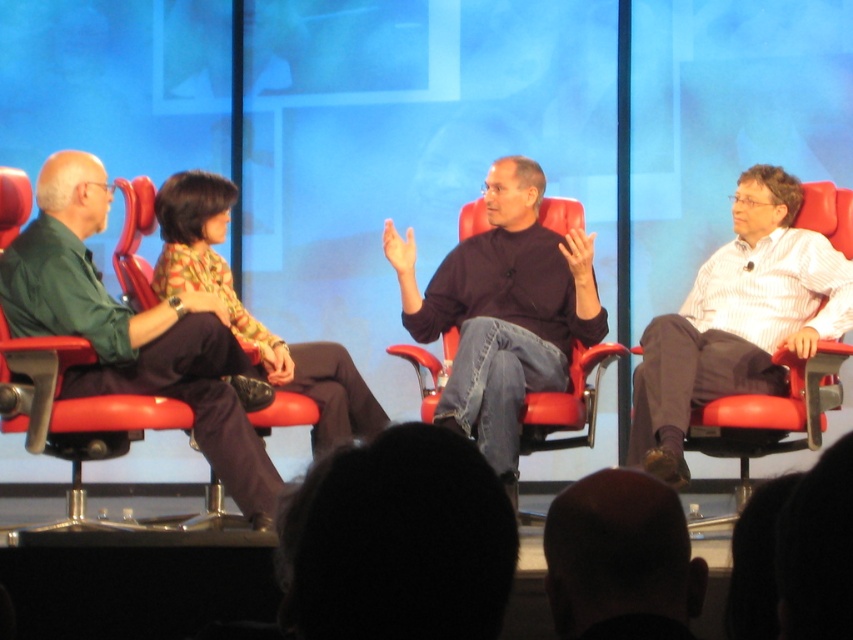
You are an event photographer at the panel discussion. You need to capture a clear photo of the speaker wearing the dark brown sweater at center without the printed fabric blouse at center appearing in the foreground. Is this possible based on their positions?

The dark brown sweater at center is positioned over the printed fabric blouse at center, so the blouse will be obscured by the sweater in the photo. Therefore, it is possible to capture a clear photo of the speaker wearing the dark brown sweater at center without the printed fabric blouse at center in the foreground.

You are a photographer at the back of the room. You want to take a photo of the bald head at center and the printed fabric blouse at center. Based on their positions, which one is closer to the front of the stage?

The bald head at center is located below the printed fabric blouse at center, so the bald head at center is closer to the front of the stage.

You are an event planner trying to set up a camera to capture the speaker at the center of the stage. The camera is placed at point A located at coordinates (619,554). Where exactly is this camera pointing at?

The point at coordinates (619,554) corresponds to the bald head at center, so the camera is pointing at the bald head at center.